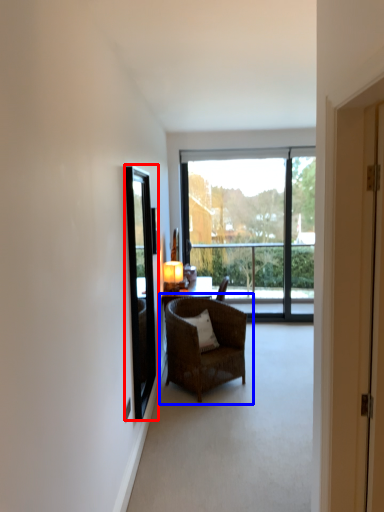
Question: Which point is further to the camera, window screen (highlighted by a red box) or chair (highlighted by a blue box)?

Choices:
 (A) window screen
 (B) chair

Answer: (B)